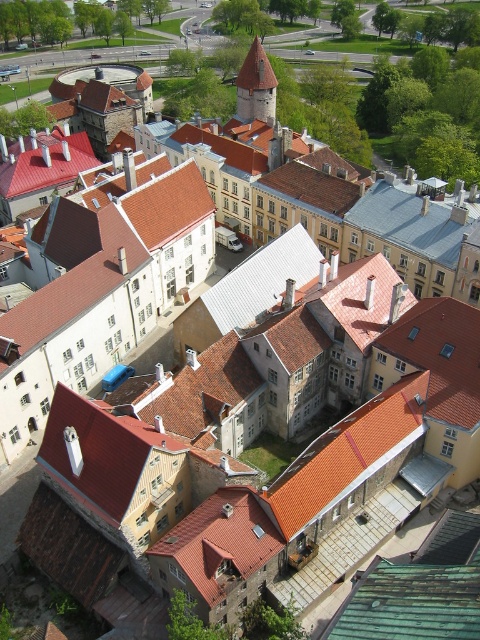
You are a drone operator flying over the historic urban area. Your drone is currently at the center of the image. You need to locate the green shingles at center. According to the coordinates provided, in which direction should you move the drone to find them?

The green shingles at center are located at coordinates point (409,604). Since the drone is at the center of the image, which is point (240,320), you should move the drone northeast to reach the green shingles at center.

You are a drone operator flying over the historic urban area. Your task is to deliver a package to the brown stone tower at center. However, there are green shingles at center nearby. Can you safely navigate between them considering their widths?

The green shingles at center might be wider than the brown stone tower at center, so there may not be enough space for the drone to navigate safely between them. It is recommended to adjust the flight path to ensure clearance.

You are a drone operator flying over the historic urban area. Your drone needs to land on the orange tile roof at center without hitting the brown stone tower at center. Can the drone safely land there?

The orange tile roof at center has a lesser height compared to the brown stone tower at center, so the drone can safely land on the orange tile roof at center as it is shorter and there is enough space around it.